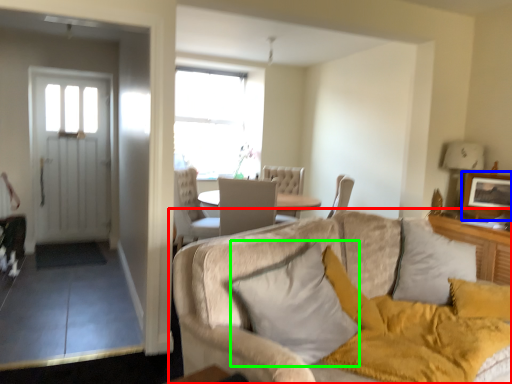
Question: Which object is positioned closest to studio couch (highlighted by a red box)? Select from picture frame (highlighted by a blue box) and pillow (highlighted by a green box).

Choices:
 (A) picture frame
 (B) pillow

Answer: (B)